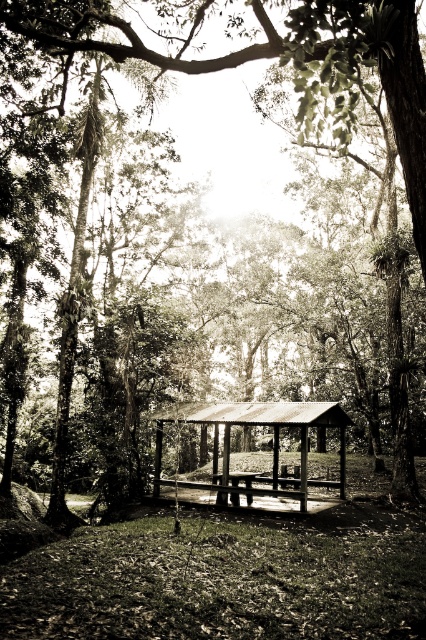
Question: Which point appears farthest from the camera in this image?

Choices:
 (A) (259, 490)
 (B) (305, 509)

Answer: (A)

Question: Does metallic/grey gazebo at center have a smaller size compared to wooden picnic table at center?

Choices:
 (A) no
 (B) yes

Answer: (A)

Question: Which point appears farthest from the camera in this image?

Choices:
 (A) (224, 502)
 (B) (201, 422)

Answer: (B)

Question: Can you confirm if metallic/grey gazebo at center is wider than wooden picnic table at center?

Choices:
 (A) yes
 (B) no

Answer: (A)

Question: Does metallic/grey gazebo at center come in front of wooden picnic table at center?

Choices:
 (A) yes
 (B) no

Answer: (A)